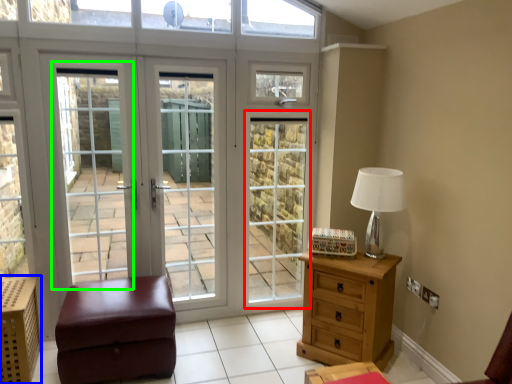
Question: Which object is positioned closest to screen door (highlighted by a red box)? Select from crate (highlighted by a blue box) and screen door (highlighted by a green box).

Choices:
 (A) crate
 (B) screen door

Answer: (B)